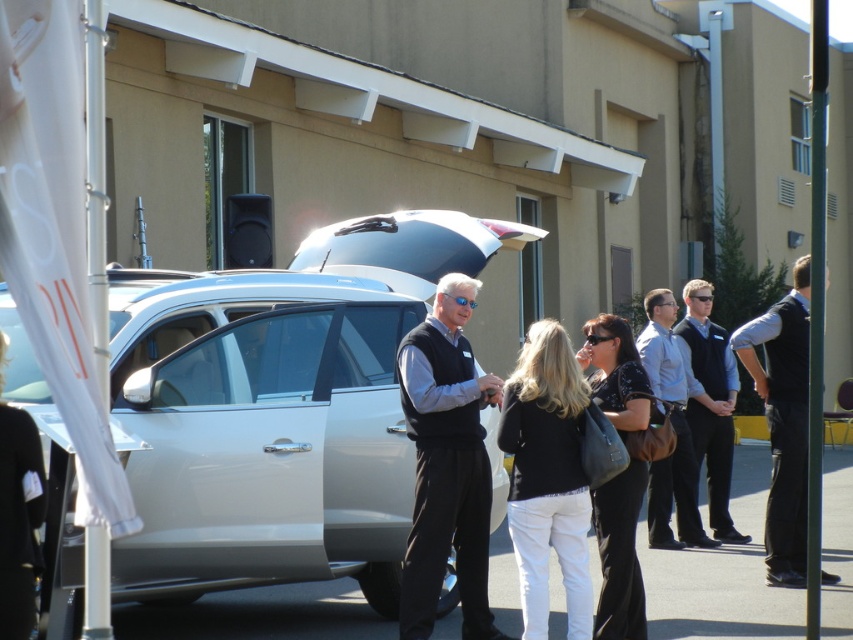
Consider the image. You are a photographer standing near the camera. You want to take a photo of the black vest at center without moving the vest. Can you do this from your current position?

The black vest at center and camera are 36.98 feet apart from each other, so yes, you can take a photo of the black vest at center from your current position as the distance is sufficient.

You are a photographer at the scene and want to capture a photo where the black matte sweater at center and dark blue vest at center are both visible. Since the photographer is positioned to the right of the subjects, which subject should be placed closer to the left side of the frame to ensure both are in the shot?

The black matte sweater at center should be placed closer to the left side of the frame because it is to the left of the dark blue vest at center, so positioning it there will keep both subjects within the camera view.